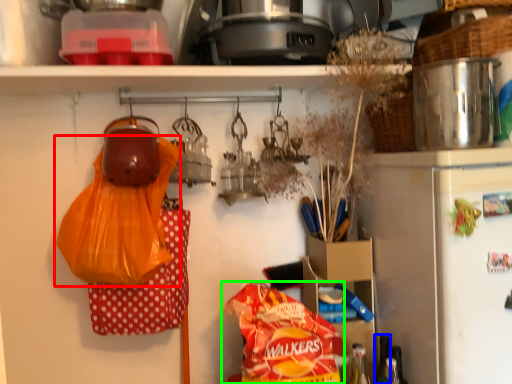
Question: Which is farther away from plastic bag (highlighted by a red box)? bottle (highlighted by a blue box) or cereal (highlighted by a green box)?

Choices:
 (A) bottle
 (B) cereal

Answer: (A)